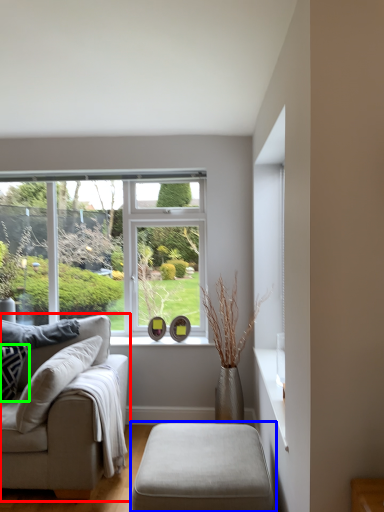
Question: Considering the real-world distances, which object is farthest from studio couch (highlighted by a red box)? table (highlighted by a blue box) or pillow (highlighted by a green box)?

Choices:
 (A) table
 (B) pillow

Answer: (A)